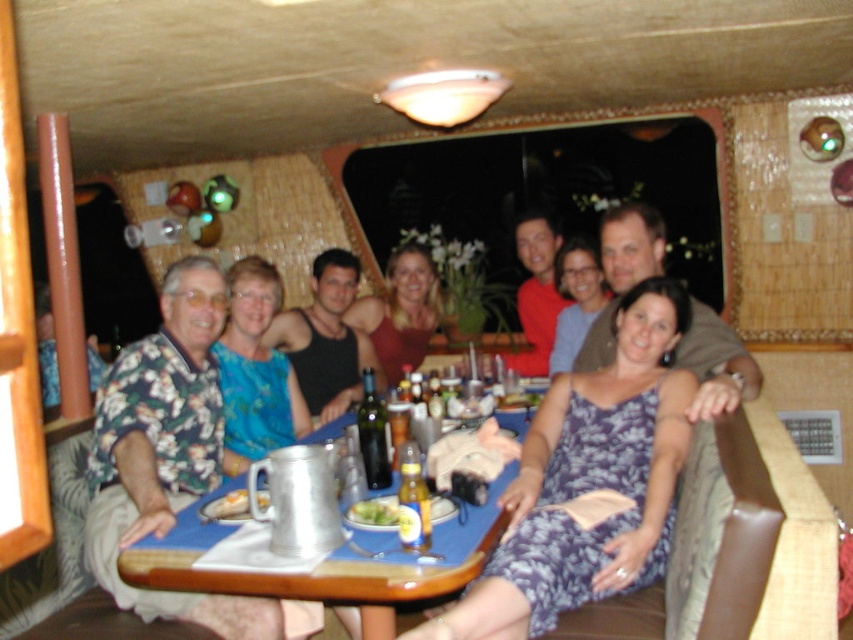
Is blue satin dress at center bigger than floral dress at center?

Yes.

Can you confirm if blue satin dress at center is smaller than floral dress at center?

Incorrect, blue satin dress at center is not smaller in size than floral dress at center.

Measure the distance between point (236, 388) and camera.

The distance of point (236, 388) from camera is 10.06 feet.

Locate an element on the screen. Image resolution: width=853 pixels, height=640 pixels. blue satin dress at center is located at coordinates (254, 371).

Does blue floral dress at center have a larger size compared to matte red dress at center?

Yes.

Which is above, blue floral dress at center or matte red dress at center?

matte red dress at center

Is point (544, 516) closer to viewer compared to point (437, 308)?

Yes.

Find the location of a particular element. The width and height of the screenshot is (853, 640). blue floral dress at center is located at coordinates (589, 483).

Image resolution: width=853 pixels, height=640 pixels. Identify the location of blue floral dress at center. (589, 483).

Is blue floral dress at center shorter than metallic silver wine bottle at center?

Incorrect, blue floral dress at center's height does not fall short of metallic silver wine bottle at center's.

Does point (498, 605) come closer to viewer compared to point (373, 458)?

Yes, it is.

The width and height of the screenshot is (853, 640). I want to click on blue floral dress at center, so click(x=589, y=483).